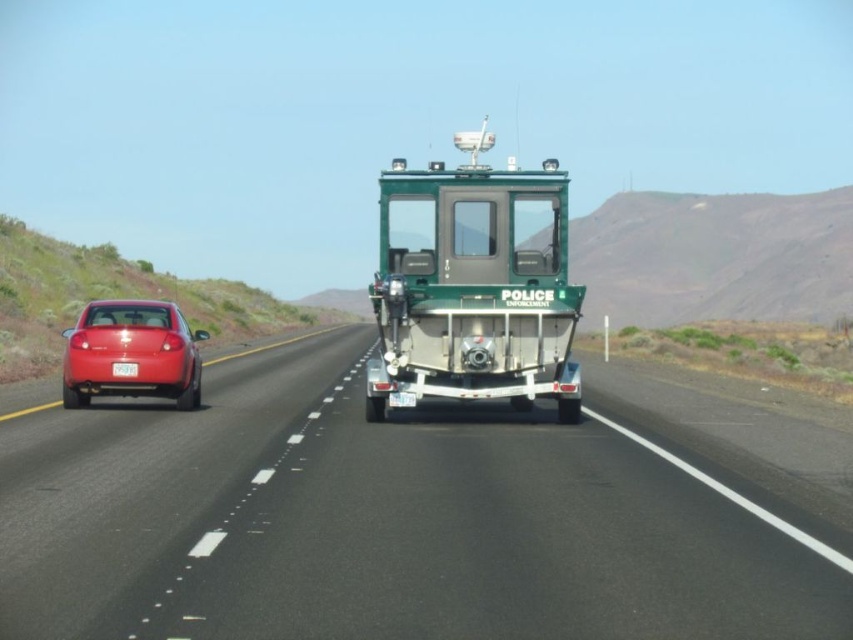
Is point (91, 577) behind point (165, 355)?

No, it is not.

Can you confirm if black asphalt road at center is positioned above matte red car at left?

Incorrect, black asphalt road at center is not positioned above matte red car at left.

Is point (166, 483) in front of point (106, 378)?

Yes.

The width and height of the screenshot is (853, 640). Find the location of `black asphalt road at center`. black asphalt road at center is located at coordinates (380, 524).

Who is taller, green matte police boat at center or white plastic license plate at center?

green matte police boat at center is taller.

Does green matte police boat at center have a lesser height compared to white plastic license plate at center?

No, green matte police boat at center is not shorter than white plastic license plate at center.

Does point (428, 326) lie behind point (132, 364)?

That is False.

At what (x,y) coordinates should I click in order to perform the action: click on green matte police boat at center. Please return your answer as a coordinate pair (x, y). Looking at the image, I should click on (473, 288).

Is point (190, 452) closer to viewer compared to point (129, 364)?

Yes, it is.

Is black asphalt road at center thinner than white plastic license plate at center?

→ Incorrect, black asphalt road at center's width is not less than white plastic license plate at center's.

Image resolution: width=853 pixels, height=640 pixels. What do you see at coordinates (380, 524) in the screenshot? I see `black asphalt road at center` at bounding box center [380, 524].

Find the location of a particular element. The image size is (853, 640). black asphalt road at center is located at coordinates (380, 524).